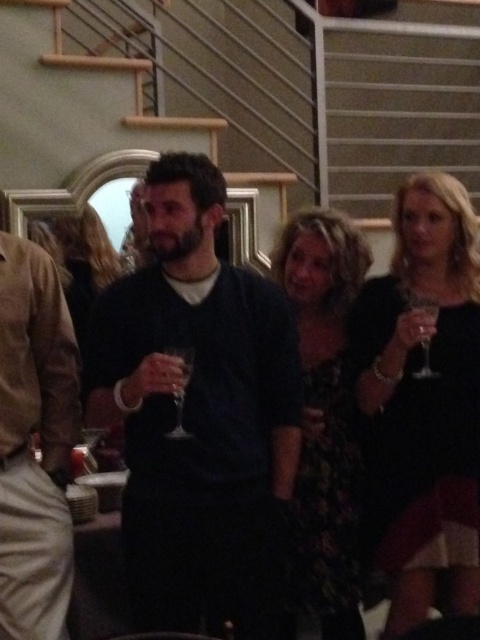
You are at a formal event and see the dark blue sweater at center and the clear glass wine glass at right. Which object is taller?

The dark blue sweater at center is much taller than the clear glass wine glass at right.

From the picture: You are at a party and want to take a photo of the black satin dress at right and the floral dress at center. Which dress should you focus on first if you want to capture both in the same frame without moving the camera?

The black satin dress at right is located above the floral dress at center, so you should focus on the black satin dress at right first to ensure both are in the frame.